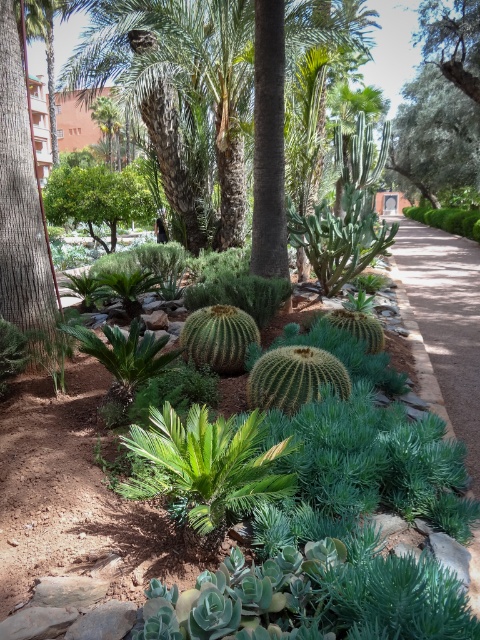
You are standing in the garden and want to take a photo of both point (41,248) and point (446,243) in the scene. Which point is closer to your camera lens?

Point (41,248) is closer to the camera lens than point (446,243).